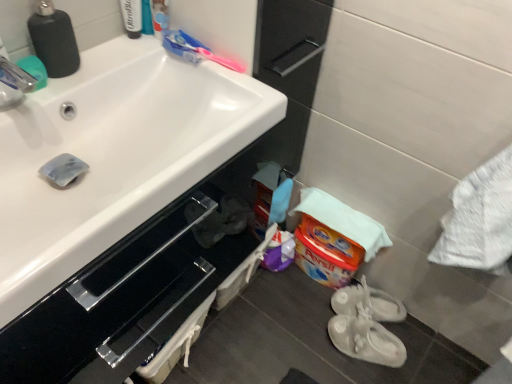
Where is `empty space that is to the right of white rubber shoes at lower right, which ranks as the 1th footwear in front-to-back order`? empty space that is to the right of white rubber shoes at lower right, which ranks as the 1th footwear in front-to-back order is located at coordinates (428, 352).